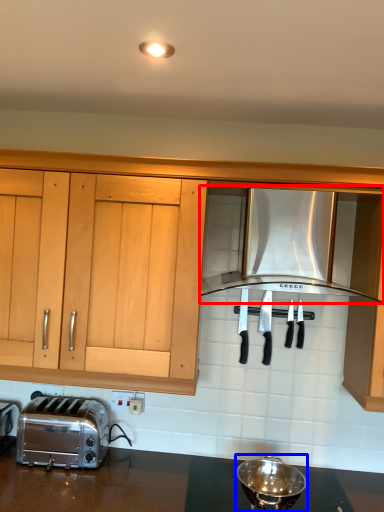
Question: Which object is further to the camera taking this photo, kitchen appliance (highlighted by a red box) or appliance (highlighted by a blue box)?

Choices:
 (A) kitchen appliance
 (B) appliance

Answer: (B)